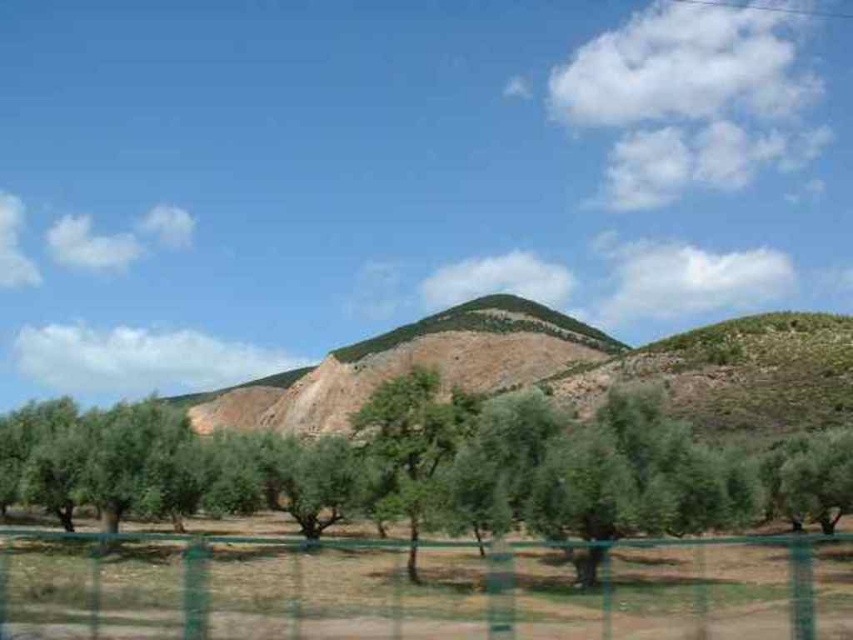
Question: Among these points, which one is farthest from the camera?

Choices:
 (A) tap(74, 598)
 (B) tap(416, 481)

Answer: (B)

Question: Can you confirm if green leafy tree at center is bigger than green wire mesh fence at lower center?

Choices:
 (A) no
 (B) yes

Answer: (B)

Question: Which point is farther from the camera taking this photo?

Choices:
 (A) (825, 582)
 (B) (502, 508)

Answer: (B)

Question: Is green leafy tree at center bigger than green wire mesh fence at lower center?

Choices:
 (A) yes
 (B) no

Answer: (A)

Question: Can you confirm if green leafy tree at center is wider than green wire mesh fence at lower center?

Choices:
 (A) yes
 (B) no

Answer: (A)